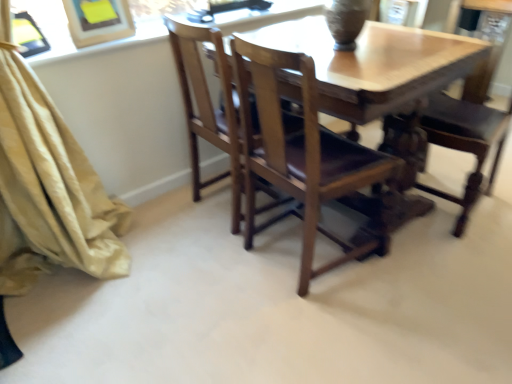
Question: From a real-world perspective, is beige fabric curtain at left positioned under matte brown vase at upper center based on gravity?

Choices:
 (A) yes
 (B) no

Answer: (A)

Question: Considering the relative sizes of beige fabric curtain at left and matte brown vase at upper center in the image provided, is beige fabric curtain at left wider than matte brown vase at upper center?

Choices:
 (A) no
 (B) yes

Answer: (B)

Question: Is beige fabric curtain at left at the right side of matte brown vase at upper center?

Choices:
 (A) no
 (B) yes

Answer: (A)

Question: Is matte brown vase at upper center inside beige fabric curtain at left?

Choices:
 (A) no
 (B) yes

Answer: (A)

Question: Considering the relative sizes of beige fabric curtain at left and matte brown vase at upper center in the image provided, is beige fabric curtain at left smaller than matte brown vase at upper center?

Choices:
 (A) yes
 (B) no

Answer: (B)

Question: Looking at the image, does beige fabric curtain at left seem bigger or smaller compared to matte brown vase at upper center?

Choices:
 (A) big
 (B) small

Answer: (A)

Question: In terms of height, does beige fabric curtain at left look taller or shorter compared to matte brown vase at upper center?

Choices:
 (A) tall
 (B) short

Answer: (A)

Question: From the image's perspective, is beige fabric curtain at left located above or below matte brown vase at upper center?

Choices:
 (A) below
 (B) above

Answer: (A)

Question: Is beige fabric curtain at left wider or thinner than matte brown vase at upper center?

Choices:
 (A) wide
 (B) thin

Answer: (A)

Question: In terms of width, does wooden chair at center, the 1th chair from the left, look wider or thinner when compared to beige fabric curtain at left?

Choices:
 (A) thin
 (B) wide

Answer: (B)

Question: From the image's perspective, is wooden chair at center, the 1th chair from the left, located above or below beige fabric curtain at left?

Choices:
 (A) above
 (B) below

Answer: (B)

Question: Looking at the image, does wooden chair at center, the 1th chair from the left, seem bigger or smaller compared to beige fabric curtain at left?

Choices:
 (A) big
 (B) small

Answer: (B)

Question: Considering the relative positions of wooden chair at center, acting as the 2th chair starting from the right, and beige fabric curtain at left in the image provided, is wooden chair at center, acting as the 2th chair starting from the right, to the left or to the right of beige fabric curtain at left?

Choices:
 (A) right
 (B) left

Answer: (A)

Question: Is wooden chair at center, which is the second chair in left-to-right order, wider or thinner than matte brown vase at upper center?

Choices:
 (A) thin
 (B) wide

Answer: (B)

Question: In the image, is wooden chair at center, the 1th chair from the right, on the left side or the right side of matte brown vase at upper center?

Choices:
 (A) right
 (B) left

Answer: (A)